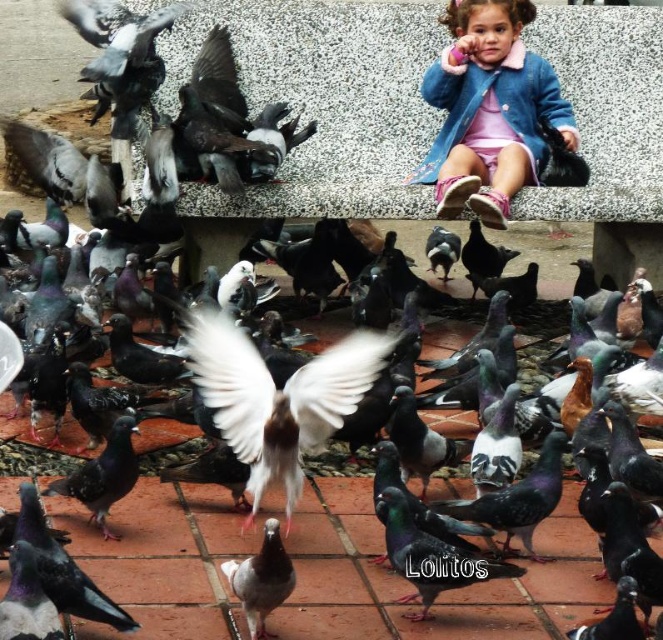
Can you confirm if blue denim jacket at upper right is thinner than white glossy bird at center?

Indeed, blue denim jacket at upper right has a lesser width compared to white glossy bird at center.

Can you confirm if blue denim jacket at upper right is positioned to the left of white glossy bird at center?

No, blue denim jacket at upper right is not to the left of white glossy bird at center.

Does point (465, 16) lie behind point (300, 440)?

Yes, it is behind point (300, 440).

At what (x,y) coordinates should I click in order to perform the action: click on blue denim jacket at upper right. Please return your answer as a coordinate pair (x, y). This screenshot has width=663, height=640. Looking at the image, I should click on (489, 109).

Is blue denim jacket at upper right thinner than white glossy pigeon at center?

In fact, blue denim jacket at upper right might be wider than white glossy pigeon at center.

Is point (534, 81) positioned behind point (290, 572)?

Yes, point (534, 81) is farther from viewer.

What do you see at coordinates (489, 109) in the screenshot?
I see `blue denim jacket at upper right` at bounding box center [489, 109].

This screenshot has width=663, height=640. I want to click on blue denim jacket at upper right, so click(x=489, y=109).

Between point (200, 340) and point (398, 572), which one is positioned in front?

Point (398, 572) is in front.

Between white glossy bird at center and speckled feathered pigeon at center, which one is positioned lower?

Positioned lower is speckled feathered pigeon at center.

Who is more distant from viewer, (286, 508) or (487, 556)?

The point (487, 556) is behind.

Identify the location of white glossy bird at center. The width and height of the screenshot is (663, 640). (276, 397).